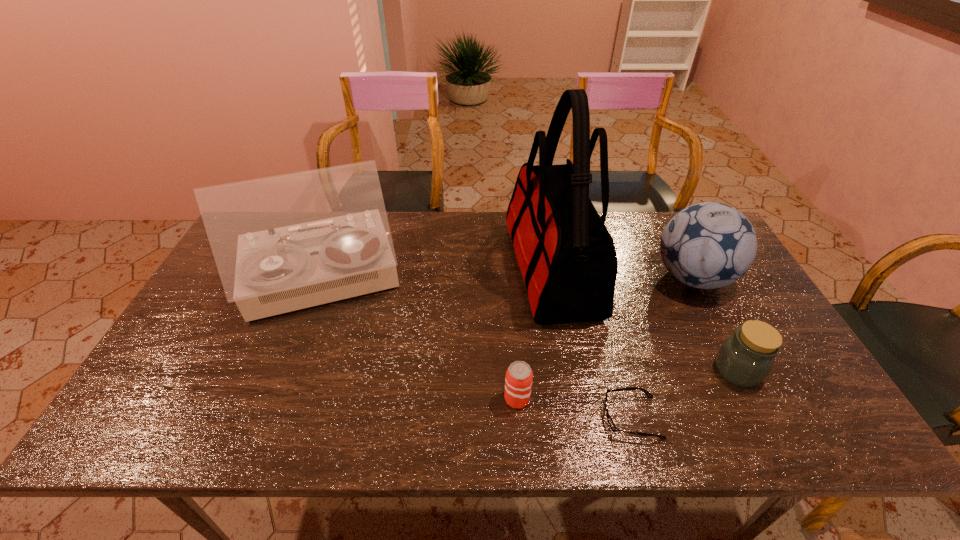
You are a GUI agent. You are given a task and a screenshot of the screen. Output one action in this format:
    pyautogui.click(x=<x>, y=<y>)
    Task: Click on the vacant space located on the side with brand of the soccer ball
    This screenshot has width=960, height=540.
    Given the screenshot: What is the action you would take?
    pyautogui.click(x=562, y=278)

Where is `free spot located on the side with brand of the soccer ball`? free spot located on the side with brand of the soccer ball is located at coordinates (539, 278).

Find the location of a particular element. The image size is (960, 540). free spot located on the left of the fourth tallest object is located at coordinates (665, 370).

The height and width of the screenshot is (540, 960). In order to click on free region located 0.120m on the right of the beer can in this screenshot , I will do pos(582,399).

Find the location of a particular element. vacant region located on the front-facing side of the shortest object is located at coordinates (435, 417).

Where is `vacant space located on the front-facing side of the shortest object`? The width and height of the screenshot is (960, 540). vacant space located on the front-facing side of the shortest object is located at coordinates (533, 417).

The image size is (960, 540). I want to click on free location located on the front-facing side of the shortest object, so click(582, 417).

This screenshot has width=960, height=540. In order to click on duffel bag situated at the far edge in this screenshot , I will do `click(567, 257)`.

This screenshot has height=540, width=960. What are the coordinates of `record player that is at the far edge` in the screenshot? It's located at (282, 243).

At what (x,y) coordinates should I click in order to perform the action: click on soccer ball at the far edge. Please return your answer as a coordinate pair (x, y). Looking at the image, I should click on (709, 245).